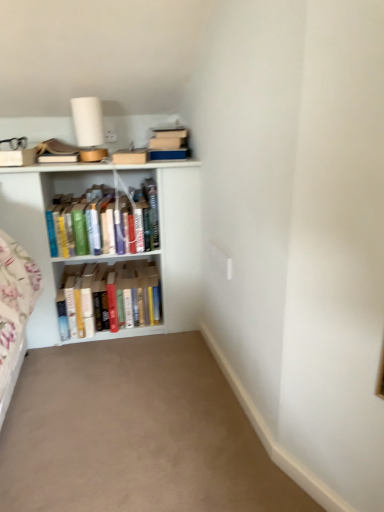
In order to click on white wooden bookshelf at left in this screenshot , I will do 109,254.

At what (x,y) coordinates should I click in order to perform the action: click on beige carpet at lower center. Please return your answer as a coordinate pair (x, y). This screenshot has width=384, height=512. Looking at the image, I should click on (135, 433).

Where is `hardcover books at center, which appears as the first book when ordered from the bottom`? hardcover books at center, which appears as the first book when ordered from the bottom is located at coordinates (108, 297).

Can you confirm if white wooden bookshelf at left is taller than beige carpet at lower center?

Yes.

Could you tell me if white wooden bookshelf at left is turned towards beige carpet at lower center?

Yes, white wooden bookshelf at left is turned towards beige carpet at lower center.

Can you confirm if white wooden bookshelf at left is positioned to the left of beige carpet at lower center?

Correct, you'll find white wooden bookshelf at left to the left of beige carpet at lower center.

Is white wooden bookshelf at left positioned beyond the bounds of beige carpet at lower center?

Yes, white wooden bookshelf at left is outside of beige carpet at lower center.

Between hardcover books at center, which is counted as the 2th book, starting from the bottom, and beige carpet at lower center, which one has larger size?

Bigger between the two is hardcover books at center, which is counted as the 2th book, starting from the bottom.

Who is taller, hardcover books at center, arranged as the first book when viewed from the top, or beige carpet at lower center?

With more height is hardcover books at center, arranged as the first book when viewed from the top.

From the image's perspective, is hardcover books at center, which is counted as the 2th book, starting from the bottom, located above beige carpet at lower center?

Yes, from the image's perspective, hardcover books at center, which is counted as the 2th book, starting from the bottom, is on top of beige carpet at lower center.

Locate an element on the screen. The height and width of the screenshot is (512, 384). plain below the hardcover books at center, arranged as the first book when viewed from the top (from the image's perspective) is located at coordinates (135, 433).

Which is nearer, (39, 233) or (100, 232)?

The point (39, 233) is closer to the camera.

Is white wooden bookshelf at left behind hardcover books at center, arranged as the first book when viewed from the top?

No, it is in front of hardcover books at center, arranged as the first book when viewed from the top.

You are a GUI agent. You are given a task and a screenshot of the screen. Output one action in this format:
    pyautogui.click(x=<x>, y=<y>)
    Task: Click on the 1st book behind the white wooden bookshelf at left
    This screenshot has width=384, height=512.
    Given the screenshot: What is the action you would take?
    pos(104,221)

Looking at this image, is white wooden bookshelf at left thinner than hardcover books at center, which is counted as the 2th book, starting from the bottom?

Yes.

Looking at this image, does beige carpet at lower center touch white wooden bookshelf at left?

No, beige carpet at lower center is not making contact with white wooden bookshelf at left.

Looking at this image, could you tell me if beige carpet at lower center is facing white wooden bookshelf at left?

No, beige carpet at lower center does not turn towards white wooden bookshelf at left.

You are a GUI agent. You are given a task and a screenshot of the screen. Output one action in this format:
    pyautogui.click(x=<x>, y=<y>)
    Task: Click on the plain that appears on the right of white wooden bookshelf at left
    
    Given the screenshot: What is the action you would take?
    pyautogui.click(x=135, y=433)

Can we say beige carpet at lower center lies outside white wooden bookshelf at left?

Yes, beige carpet at lower center is located beyond the bounds of white wooden bookshelf at left.

Is hardcover books at center, which appears as the first book when ordered from the bottom, facing away from beige carpet at lower center?

No, hardcover books at center, which appears as the first book when ordered from the bottom,'s orientation is not away from beige carpet at lower center.

Can you tell me how much hardcover books at center, which appears as the first book when ordered from the bottom, and beige carpet at lower center differ in facing direction?

The angle between the facing direction of hardcover books at center, which appears as the first book when ordered from the bottom, and the facing direction of beige carpet at lower center is 90.2 degrees.

Is hardcover books at center, which appears as the first book when ordered from the bottom, next to beige carpet at lower center?

hardcover books at center, which appears as the first book when ordered from the bottom, is not next to beige carpet at lower center, and they're not touching.

From a real-world perspective, between hardcover books at center, which is the 2th book from top to bottom, and beige carpet at lower center, who is vertically higher?

In real-world perspective, hardcover books at center, which is the 2th book from top to bottom, is above.

From the picture: Considering the relative positions of hardcover books at center, which is the 2th book from top to bottom, and white wooden bookshelf at left in the image provided, is hardcover books at center, which is the 2th book from top to bottom, to the left of white wooden bookshelf at left from the viewer's perspective?

No.

From the image's perspective, which one is positioned higher, hardcover books at center, which is the 2th book from top to bottom, or white wooden bookshelf at left?

white wooden bookshelf at left is shown above in the image.

Who is smaller, hardcover books at center, which is the 2th book from top to bottom, or white wooden bookshelf at left?

Smaller between the two is hardcover books at center, which is the 2th book from top to bottom.

Is hardcover books at center, arranged as the first book when viewed from the top, positioned with its back to hardcover books at center, which is the 2th book from top to bottom?

No.

From the picture: From the image's perspective, would you say hardcover books at center, arranged as the first book when viewed from the top, is positioned over hardcover books at center, which is the 2th book from top to bottom?

Yes, from the image's perspective, hardcover books at center, arranged as the first book when viewed from the top, is on top of hardcover books at center, which is the 2th book from top to bottom.

Where is `book lying in front of the hardcover books at center, which appears as the first book when ordered from the bottom`? The width and height of the screenshot is (384, 512). book lying in front of the hardcover books at center, which appears as the first book when ordered from the bottom is located at coordinates (104, 221).

Which is more to the left, hardcover books at center, arranged as the first book when viewed from the top, or hardcover books at center, which is the 2th book from top to bottom?

hardcover books at center, arranged as the first book when viewed from the top.

Locate an element on the screen. plain below the white wooden bookshelf at left (from a real-world perspective) is located at coordinates (135, 433).

This screenshot has width=384, height=512. What are the coordinates of `plain on the right of hardcover books at center, arranged as the first book when viewed from the top` in the screenshot? It's located at (135, 433).

Looking at the image, which one is located closer to white wooden bookshelf at left, hardcover books at center, arranged as the first book when viewed from the top, or beige carpet at lower center?

hardcover books at center, arranged as the first book when viewed from the top.

Estimate the real-world distances between objects in this image. Which object is closer to white wooden bookshelf at left, hardcover books at center, which is counted as the 2th book, starting from the bottom, or hardcover books at center, which is the 2th book from top to bottom?

Among the two, hardcover books at center, which is counted as the 2th book, starting from the bottom, is located nearer to white wooden bookshelf at left.

Looking at the image, which one is located closer to hardcover books at center, arranged as the first book when viewed from the top, white wooden bookshelf at left or beige carpet at lower center?

white wooden bookshelf at left is closer to hardcover books at center, arranged as the first book when viewed from the top.

From the image, which object appears to be farther from hardcover books at center, which appears as the first book when ordered from the bottom, hardcover books at center, which is counted as the 2th book, starting from the bottom, or white wooden bookshelf at left?

hardcover books at center, which is counted as the 2th book, starting from the bottom.

Based on their spatial positions, is hardcover books at center, which appears as the first book when ordered from the bottom, or beige carpet at lower center further from white wooden bookshelf at left?

beige carpet at lower center.

Consider the image. When comparing their distances from hardcover books at center, which is the 2th book from top to bottom, does beige carpet at lower center or hardcover books at center, which is counted as the 2th book, starting from the bottom, seem closer?

hardcover books at center, which is counted as the 2th book, starting from the bottom.

When comparing their distances from hardcover books at center, arranged as the first book when viewed from the top, does hardcover books at center, which appears as the first book when ordered from the bottom, or white wooden bookshelf at left seem further?

hardcover books at center, which appears as the first book when ordered from the bottom.

In the scene shown: Estimate the real-world distances between objects in this image. Which object is further from white wooden bookshelf at left, hardcover books at center, which appears as the first book when ordered from the bottom, or hardcover books at center, which is counted as the 2th book, starting from the bottom?

hardcover books at center, which appears as the first book when ordered from the bottom.

Image resolution: width=384 pixels, height=512 pixels. In order to click on shelf between hardcover books at center, which is counted as the 2th book, starting from the bottom, and hardcover books at center, which appears as the first book when ordered from the bottom, in the vertical direction in this screenshot , I will do `click(109, 254)`.

This screenshot has width=384, height=512. I want to click on shelf between hardcover books at center, which is counted as the 2th book, starting from the bottom, and beige carpet at lower center vertically, so click(x=109, y=254).

Find the location of `book positioned between beige carpet at lower center and hardcover books at center, which is the 2th book from top to bottom, from near to far`. book positioned between beige carpet at lower center and hardcover books at center, which is the 2th book from top to bottom, from near to far is located at coordinates (104, 221).

Find the location of `shelf positioned between beige carpet at lower center and hardcover books at center, which appears as the first book when ordered from the bottom, from near to far`. shelf positioned between beige carpet at lower center and hardcover books at center, which appears as the first book when ordered from the bottom, from near to far is located at coordinates (109, 254).